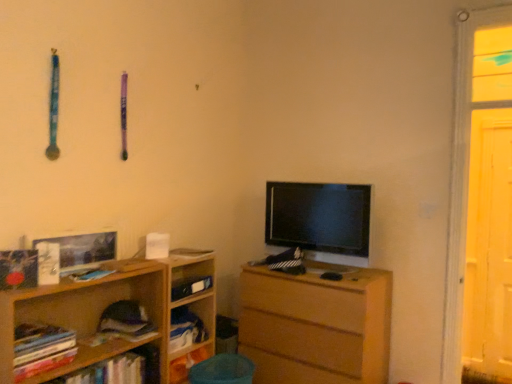
I want to click on wooden bookshelf at left, the 1th shelf when ordered from front to back, so click(106, 306).

This screenshot has height=384, width=512. What are the coordinates of `transparent plastic screen door at right` in the screenshot? It's located at (489, 247).

The height and width of the screenshot is (384, 512). What do you see at coordinates (125, 321) in the screenshot? I see `soft purple fabric book at lower left, which ranks as the 3th book in front-to-back order` at bounding box center [125, 321].

Identify the location of hardcover book at center, placed as the 1th book when sorted from back to front. The height and width of the screenshot is (384, 512). (190, 287).

This screenshot has height=384, width=512. Find the location of `wooden bookshelf at lower left, which ranks as the 1th shelf in back-to-front order`. wooden bookshelf at lower left, which ranks as the 1th shelf in back-to-front order is located at coordinates (187, 310).

The height and width of the screenshot is (384, 512). Identify the location of book that is the 2nd one below the hardcover book at center, the second book viewed from the front (from a real-world perspective). (125, 321).

Does point (130, 328) lie behind point (78, 281)?

Yes, point (130, 328) is behind point (78, 281).

Would you say soft purple fabric book at lower left, which ranks as the 3th book in front-to-back order, contains hardcover book at center, which is counted as the third book, starting from the back?

No, hardcover book at center, which is counted as the third book, starting from the back, is not a part of soft purple fabric book at lower left, which ranks as the 3th book in front-to-back order.

Looking at this image, from a real-world perspective, is soft purple fabric book at lower left, which ranks as the 3th book in front-to-back order, physically below hardcover book at center, the second book viewed from the front?

Indeed, from a real-world perspective, soft purple fabric book at lower left, which ranks as the 3th book in front-to-back order, is positioned beneath hardcover book at center, the second book viewed from the front.

Is point (102, 270) positioned after point (198, 314)?

No, it is not.

Which book is the 2nd one when counting from the front of the wooden bookshelf at lower left, which ranks as the 1th shelf in back-to-front order? Please provide its 2D coordinates.

[(91, 275)]

Relative to wooden bookshelf at lower left, which ranks as the 1th shelf in back-to-front order, is hardcover book at center, the second book viewed from the front, in front or behind?

hardcover book at center, the second book viewed from the front, is in front of wooden bookshelf at lower left, which ranks as the 1th shelf in back-to-front order.

Could you measure the distance between hardcover book at center, the second book viewed from the front, and wooden bookshelf at lower left, marked as the second shelf in a front-to-back arrangement?

The distance of hardcover book at center, the second book viewed from the front, from wooden bookshelf at lower left, marked as the second shelf in a front-to-back arrangement, is 58.89 centimeters.

Is point (501, 226) closer to camera compared to point (102, 322)?

No, (501, 226) is further to viewer.

Consider the image. Considering the relative positions of transparent plastic screen door at right and soft purple fabric book at lower left, acting as the second book starting from the back, in the image provided, is transparent plastic screen door at right to the left of soft purple fabric book at lower left, acting as the second book starting from the back, from the viewer's perspective?

No, transparent plastic screen door at right is not to the left of soft purple fabric book at lower left, acting as the second book starting from the back.

Can you confirm if transparent plastic screen door at right is shorter than soft purple fabric book at lower left, acting as the second book starting from the back?

No, transparent plastic screen door at right is not shorter than soft purple fabric book at lower left, acting as the second book starting from the back.

Considering the relative sizes of transparent plastic screen door at right and soft purple fabric book at lower left, acting as the second book starting from the back, in the image provided, is transparent plastic screen door at right smaller than soft purple fabric book at lower left, acting as the second book starting from the back,?

No, transparent plastic screen door at right is not smaller than soft purple fabric book at lower left, acting as the second book starting from the back.

Does hardcover books at left, positioned as the 4th book in back-to-front order, have a lesser height compared to wooden chest of drawers at center?

Correct, hardcover books at left, positioned as the 4th book in back-to-front order, is not as tall as wooden chest of drawers at center.

Is hardcover books at left, acting as the first book starting from the front, oriented away from wooden chest of drawers at center?

No, hardcover books at left, acting as the first book starting from the front,'s orientation is not away from wooden chest of drawers at center.

Is hardcover books at left, positioned as the 4th book in back-to-front order, not near wooden chest of drawers at center?

Indeed, hardcover books at left, positioned as the 4th book in back-to-front order, is not near wooden chest of drawers at center.

Does hardcover books at left, positioned as the 4th book in back-to-front order, appear on the right side of wooden chest of drawers at center?

In fact, hardcover books at left, positioned as the 4th book in back-to-front order, is to the left of wooden chest of drawers at center.

Does hardcover books at left, positioned as the 4th book in back-to-front order, appear on the right side of soft purple fabric book at lower left, which ranks as the 3th book in front-to-back order?

Incorrect, hardcover books at left, positioned as the 4th book in back-to-front order, is not on the right side of soft purple fabric book at lower left, which ranks as the 3th book in front-to-back order.

Between hardcover books at left, positioned as the 4th book in back-to-front order, and soft purple fabric book at lower left, which ranks as the 3th book in front-to-back order, which one has more height?

With more height is soft purple fabric book at lower left, which ranks as the 3th book in front-to-back order.

From the image's perspective, who appears lower, hardcover books at left, positioned as the 4th book in back-to-front order, or soft purple fabric book at lower left, acting as the second book starting from the back?

hardcover books at left, positioned as the 4th book in back-to-front order, from the image's perspective.

From a real-world perspective, is hardcover books at left, acting as the first book starting from the front, positioned above or below soft purple fabric book at lower left, which ranks as the 3th book in front-to-back order?

hardcover books at left, acting as the first book starting from the front, is situated lower than soft purple fabric book at lower left, which ranks as the 3th book in front-to-back order, in the real world.

From the image's perspective, is hardcover book at center, which is counted as the third book, starting from the back, over transparent plastic screen door at right?

Correct, hardcover book at center, which is counted as the third book, starting from the back, appears higher than transparent plastic screen door at right in the image.

In the scene shown: Which point is more forward, (84, 274) or (507, 246)?

Point (84, 274)

I want to click on screen door that is below the hardcover book at center, which is counted as the third book, starting from the back (from the image's perspective), so click(x=489, y=247).

Which object is wider, hardcover book at center, the second book viewed from the front, or transparent plastic screen door at right?

hardcover book at center, the second book viewed from the front.

Does hardcover book at center, placed as the 1th book when sorted from back to front, have a greater width compared to wooden chest of drawers at center?

In fact, hardcover book at center, placed as the 1th book when sorted from back to front, might be narrower than wooden chest of drawers at center.

Can you confirm if hardcover book at center, marked as the 4th book in a front-to-back arrangement, is smaller than wooden chest of drawers at center?

Yes.

From the image's perspective, which one is positioned higher, hardcover book at center, marked as the 4th book in a front-to-back arrangement, or wooden chest of drawers at center?

hardcover book at center, marked as the 4th book in a front-to-back arrangement, is shown above in the image.

Find the location of `the 2nd book below the hardcover book at center, which is counted as the third book, starting from the back (from the image's perspective)`. the 2nd book below the hardcover book at center, which is counted as the third book, starting from the back (from the image's perspective) is located at coordinates (125, 321).

There is a wooden bookshelf at lower left, which ranks as the 1th shelf in back-to-front order. At what (x,y) coordinates should I click in order to perform the action: click on the 4th book above it (from the image's perspective). Please return your answer as a coordinate pair (x, y). The image size is (512, 384). Looking at the image, I should click on (91, 275).

Which object lies further to the anchor point hardcover book at center, marked as the 4th book in a front-to-back arrangement, wooden bookshelf at left, which is the 2th shelf in back-to-front order, or hardcover books at left, positioned as the 4th book in back-to-front order?

hardcover books at left, positioned as the 4th book in back-to-front order, is further to hardcover book at center, marked as the 4th book in a front-to-back arrangement.

Estimate the real-world distances between objects in this image. Which object is closer to hardcover book at center, placed as the 1th book when sorted from back to front, hardcover book at center, which is counted as the third book, starting from the back, or wooden bookshelf at lower left, marked as the second shelf in a front-to-back arrangement?

Among the two, wooden bookshelf at lower left, marked as the second shelf in a front-to-back arrangement, is located nearer to hardcover book at center, placed as the 1th book when sorted from back to front.

Based on the photo, looking at the image, which one is located closer to wooden chest of drawers at center, hardcover books at left, positioned as the 4th book in back-to-front order, or wooden bookshelf at left, the 1th shelf when ordered from front to back?

Based on the image, wooden bookshelf at left, the 1th shelf when ordered from front to back, appears to be nearer to wooden chest of drawers at center.

Based on their spatial positions, is transparent plastic screen door at right or black glossy tv at center closer to soft purple fabric book at lower left, acting as the second book starting from the back?

Among the two, black glossy tv at center is located nearer to soft purple fabric book at lower left, acting as the second book starting from the back.

Estimate the real-world distances between objects in this image. Which object is further from soft purple fabric book at lower left, which ranks as the 3th book in front-to-back order, wooden bookshelf at lower left, which ranks as the 1th shelf in back-to-front order, or transparent plastic screen door at right?

transparent plastic screen door at right.

Looking at the image, which one is located further to hardcover book at center, marked as the 4th book in a front-to-back arrangement, soft purple fabric book at lower left, acting as the second book starting from the back, or wooden chest of drawers at center?

wooden chest of drawers at center lies further to hardcover book at center, marked as the 4th book in a front-to-back arrangement, than the other object.

Looking at this image, estimate the real-world distances between objects in this image. Which object is further from wooden bookshelf at lower left, which ranks as the 1th shelf in back-to-front order, hardcover book at center, the second book viewed from the front, or hardcover books at left, acting as the first book starting from the front?

Based on the image, hardcover books at left, acting as the first book starting from the front, appears to be further to wooden bookshelf at lower left, which ranks as the 1th shelf in back-to-front order.

Estimate the real-world distances between objects in this image. Which object is closer to wooden chest of drawers at center, soft purple fabric book at lower left, acting as the second book starting from the back, or wooden bookshelf at lower left, which ranks as the 1th shelf in back-to-front order?

wooden bookshelf at lower left, which ranks as the 1th shelf in back-to-front order.

Identify the location of the chest of drawers situated between black glossy tv at center and transparent plastic screen door at right from left to right. (316, 325).

Find the location of a particular element. Image resolution: width=512 pixels, height=384 pixels. shelf situated between soft purple fabric book at lower left, which ranks as the 3th book in front-to-back order, and wooden chest of drawers at center from left to right is located at coordinates (187, 310).

The width and height of the screenshot is (512, 384). I want to click on television between soft purple fabric book at lower left, which ranks as the 3th book in front-to-back order, and wooden chest of drawers at center, in the horizontal direction, so click(319, 217).

You are a GUI agent. You are given a task and a screenshot of the screen. Output one action in this format:
    pyautogui.click(x=<x>, y=<y>)
    Task: Click on the book between wooden bookshelf at lower left, which ranks as the 1th shelf in back-to-front order, and wooden chest of drawers at center from left to right
    
    Given the screenshot: What is the action you would take?
    190,287